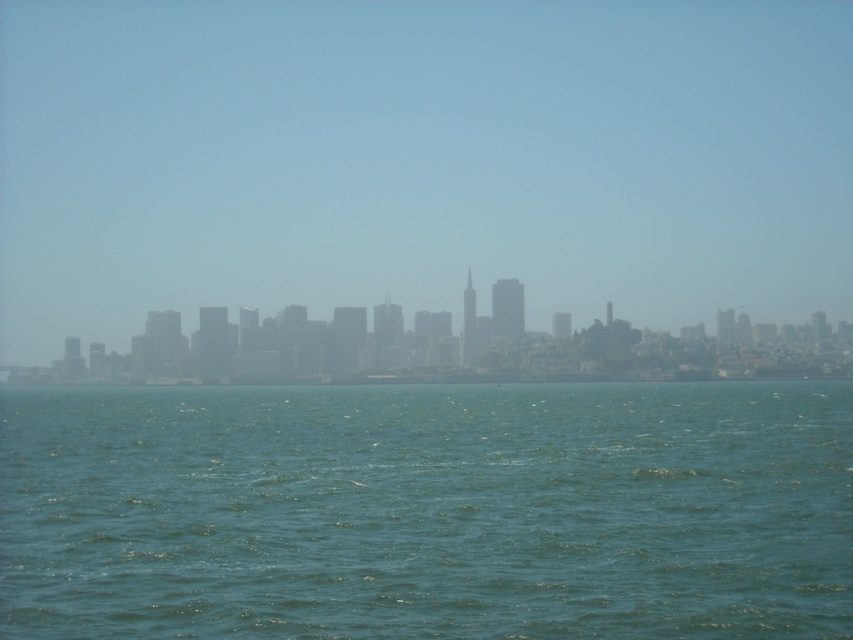
Is transparent foggy skyline at center smaller than gray foggy skyline at center?

Incorrect, transparent foggy skyline at center is not smaller in size than gray foggy skyline at center.

Does transparent foggy skyline at center have a lesser width compared to gray foggy skyline at center?

Incorrect, transparent foggy skyline at center's width is not less than gray foggy skyline at center's.

Who is more forward, (167, 289) or (241, 332)?

Point (241, 332) is more forward.

The height and width of the screenshot is (640, 853). I want to click on transparent foggy skyline at center, so click(421, 161).

Can you confirm if transparent foggy skyline at center is thinner than green water at lower center?

In fact, transparent foggy skyline at center might be wider than green water at lower center.

Which is behind, point (439, 272) or point (752, 417)?

Positioned behind is point (439, 272).

Where is `transparent foggy skyline at center`? This screenshot has width=853, height=640. transparent foggy skyline at center is located at coordinates (421, 161).

Where is `transparent foggy skyline at center`? transparent foggy skyline at center is located at coordinates (421, 161).

Can you confirm if green water at lower center is thinner than gray foggy skyline at center?

Correct, green water at lower center's width is less than gray foggy skyline at center's.

Does point (289, 433) come in front of point (25, 372)?

Yes, point (289, 433) is in front of point (25, 372).

Describe the element at coordinates (427, 509) in the screenshot. Image resolution: width=853 pixels, height=640 pixels. I see `green water at lower center` at that location.

Locate an element on the screen. This screenshot has height=640, width=853. green water at lower center is located at coordinates (427, 509).